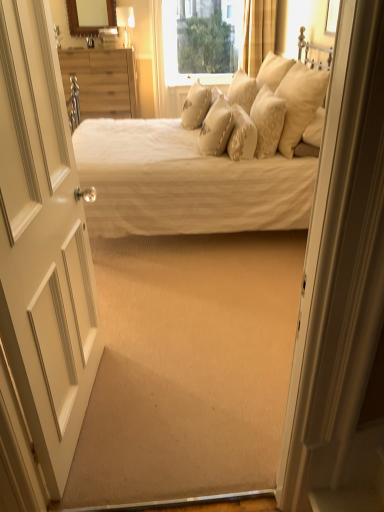
I want to click on unoccupied space behind white wood door at left, so click(134, 335).